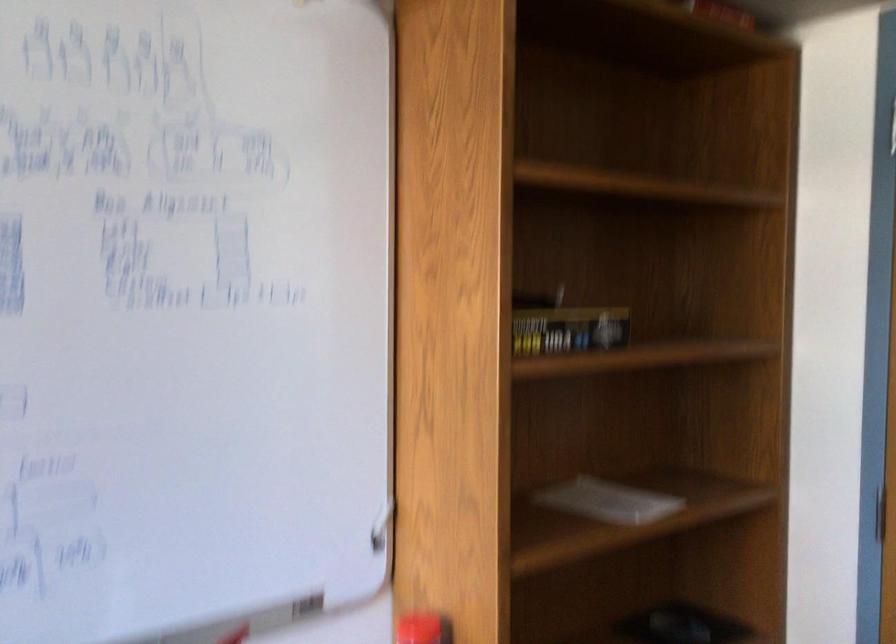
Question: Based on the continuous images, in which direction is the camera rotating? Reply with the corresponding letter.

Choices:
 (A) Left
 (B) Right
 (C) Up
 (D) Down

Answer: (B)